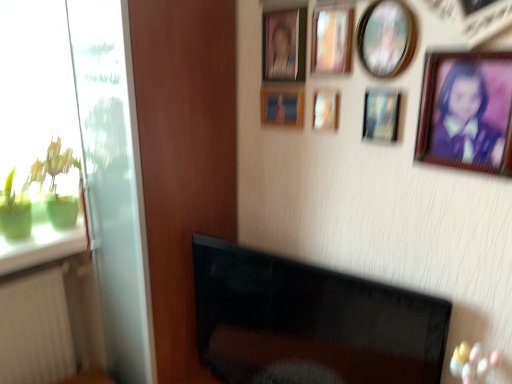
Question: Does matte plastic picture frame at upper center, arranged as the sixth picture frame when viewed from the right, have a greater width compared to transparent glass door at left?

Choices:
 (A) no
 (B) yes

Answer: (A)

Question: Does matte plastic picture frame at upper center, which is the 2th picture frame from left to right, turn towards transparent glass door at left?

Choices:
 (A) yes
 (B) no

Answer: (B)

Question: Is matte plastic picture frame at upper center, arranged as the sixth picture frame when viewed from the right, positioned in front of transparent glass door at left?

Choices:
 (A) no
 (B) yes

Answer: (A)

Question: Is transparent glass door at left a part of matte plastic picture frame at upper center, arranged as the sixth picture frame when viewed from the right?

Choices:
 (A) no
 (B) yes

Answer: (A)

Question: Is matte plastic picture frame at upper center, arranged as the sixth picture frame when viewed from the right, shorter than transparent glass door at left?

Choices:
 (A) yes
 (B) no

Answer: (A)

Question: Is point (20, 329) positioned closer to the camera than point (338, 72)?

Choices:
 (A) farther
 (B) closer

Answer: (A)

Question: Based on their positions, is white plastic radiator at lower left located to the left or right of wooden picture frame at upper center, marked as the 4th picture frame in a right-to-left arrangement?

Choices:
 (A) right
 (B) left

Answer: (B)

Question: Is white plastic radiator at lower left spatially inside wooden picture frame at upper center, which is counted as the 4th picture frame, starting from the left, or outside of it?

Choices:
 (A) outside
 (B) inside

Answer: (A)

Question: Looking at their shapes, would you say white plastic radiator at lower left is wider or thinner than wooden picture frame at upper center, marked as the 4th picture frame in a right-to-left arrangement?

Choices:
 (A) wide
 (B) thin

Answer: (A)

Question: From the image's perspective, is green glass at left positioned above or below white plastic radiator at lower left?

Choices:
 (A) above
 (B) below

Answer: (A)

Question: Is green glass at left taller or shorter than white plastic radiator at lower left?

Choices:
 (A) short
 (B) tall

Answer: (A)

Question: Does point (17, 243) appear closer or farther from the camera than point (20, 284)?

Choices:
 (A) farther
 (B) closer

Answer: (A)

Question: From a real-world perspective, is green glass at left physically located above or below white plastic radiator at lower left?

Choices:
 (A) below
 (B) above

Answer: (B)

Question: In the image, is wooden picture frame at upper center, marked as the 3th picture frame in a left-to-right arrangement, positioned in front of or behind transparent glass door at left?

Choices:
 (A) behind
 (B) front

Answer: (A)

Question: Considering the positions of point (320, 91) and point (136, 173), is point (320, 91) closer or farther from the camera than point (136, 173)?

Choices:
 (A) closer
 (B) farther

Answer: (A)